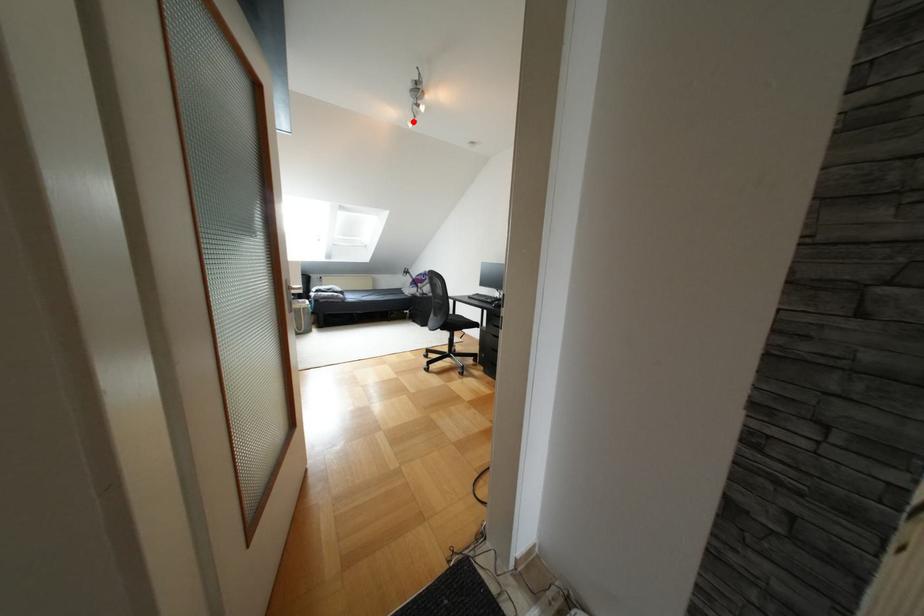
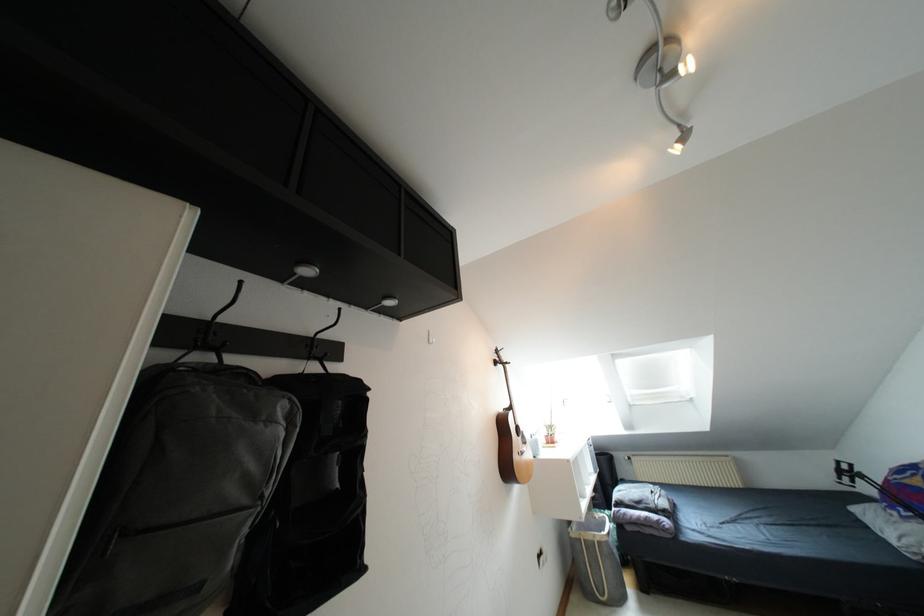
In the second image, find the point that corresponds to the highlighted location in the first image.

(683, 138)